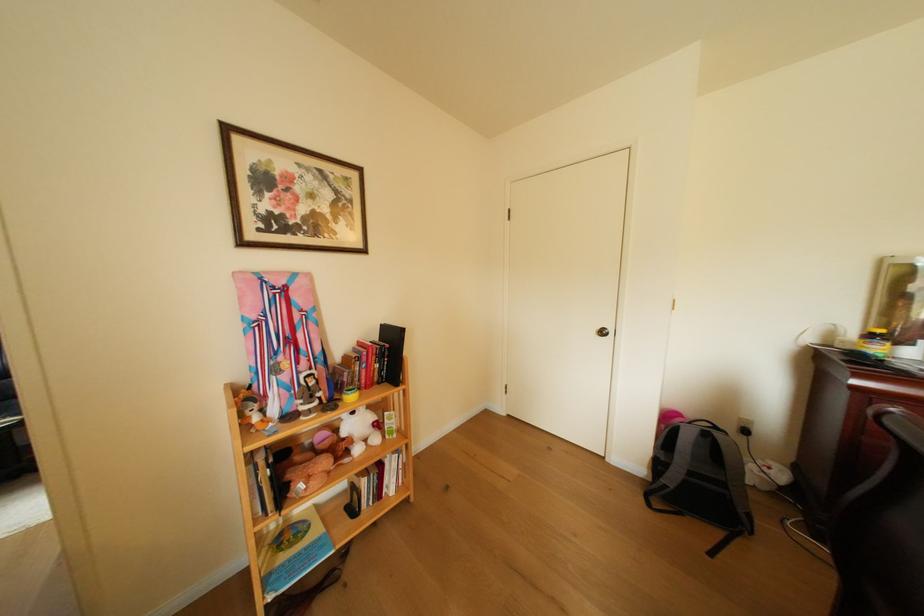
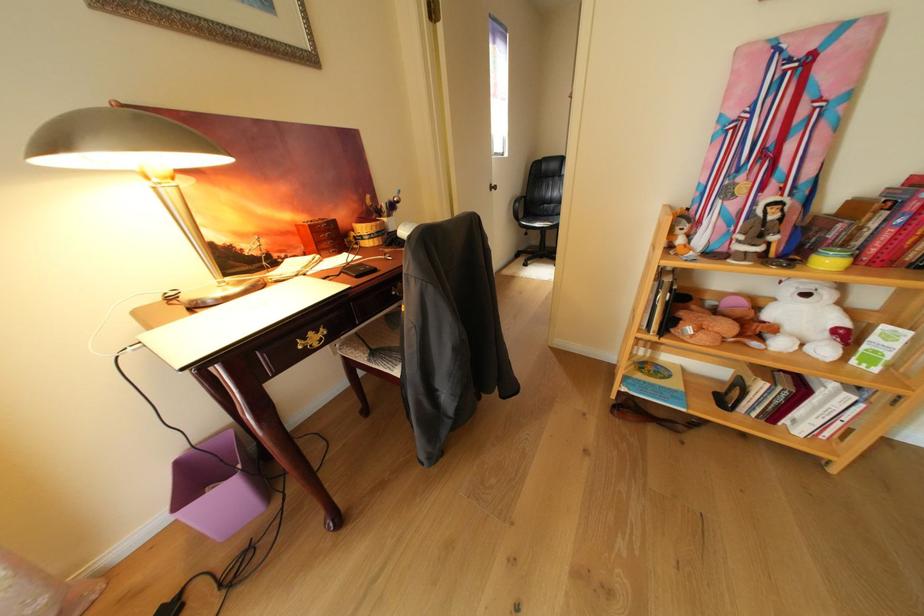
How did the camera likely rotate?

The rotation direction of the camera is left-down.